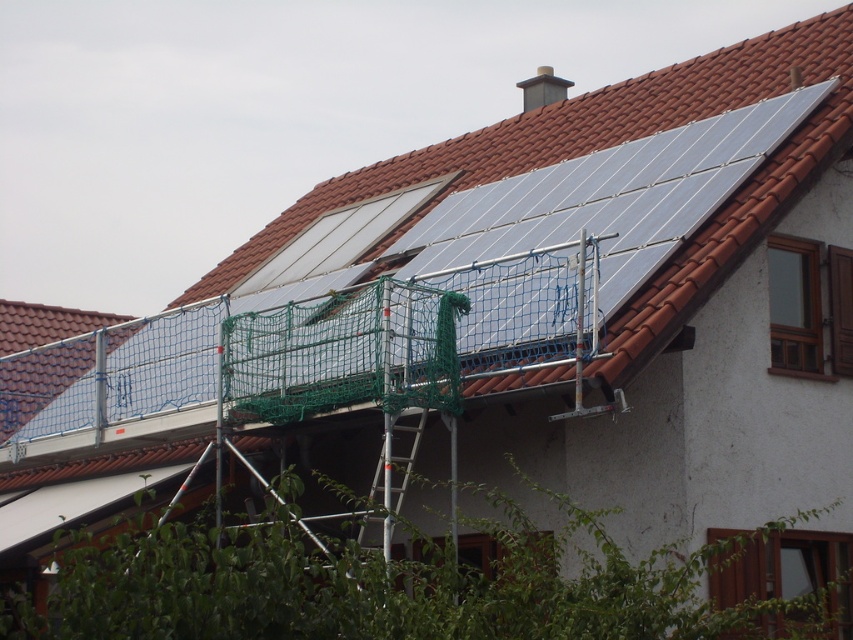
Consider the image. Between metallic solar panels at upper center and silver metallic ladder at center, which one has more height?

metallic solar panels at upper center

Is metallic solar panels at upper center above silver metallic ladder at center?

Yes.

Image resolution: width=853 pixels, height=640 pixels. I want to click on metallic solar panels at upper center, so click(511, 266).